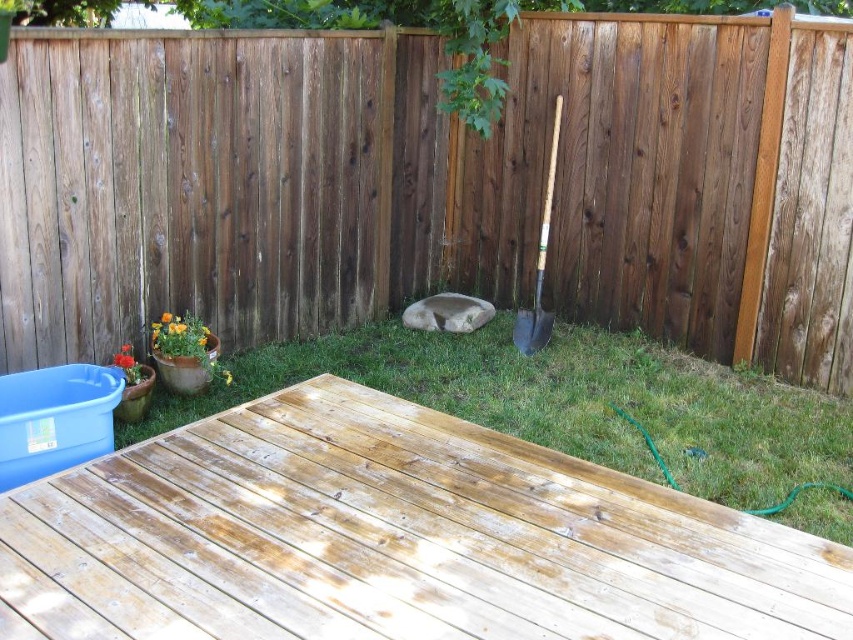
Who is shorter, brown wooden fence at upper center or wooden handle shovel at center right?

With less height is wooden handle shovel at center right.

Measure the distance from brown wooden fence at upper center to wooden handle shovel at center right.

They are 35.76 inches apart.

Between point (772, 44) and point (543, 243), which one is positioned in front?

Point (772, 44) is more forward.

This screenshot has width=853, height=640. Identify the location of brown wooden fence at upper center. [x=431, y=182].

Can you confirm if brown wooden fence at upper center is taller than green grass at center?

Indeed, brown wooden fence at upper center has a greater height compared to green grass at center.

Who is more distant from viewer, (258,125) or (729,497)?

Positioned behind is point (258,125).

Which is in front, point (51, 227) or point (732, 440)?

Point (51, 227) is more forward.

You are a GUI agent. You are given a task and a screenshot of the screen. Output one action in this format:
    pyautogui.click(x=<x>, y=<y>)
    Task: Click on the brown wooden fence at upper center
    The height and width of the screenshot is (640, 853).
    Given the screenshot: What is the action you would take?
    pyautogui.click(x=431, y=182)

Is brown wooden fence at upper center taller than weathered wood deck at lower left?

Yes, brown wooden fence at upper center is taller than weathered wood deck at lower left.

Is brown wooden fence at upper center closer to camera compared to weathered wood deck at lower left?

No, brown wooden fence at upper center is further to the viewer.

Is point (804, 29) positioned behind point (602, 483)?

That is True.

What are the coordinates of `brown wooden fence at upper center` in the screenshot? It's located at (431, 182).